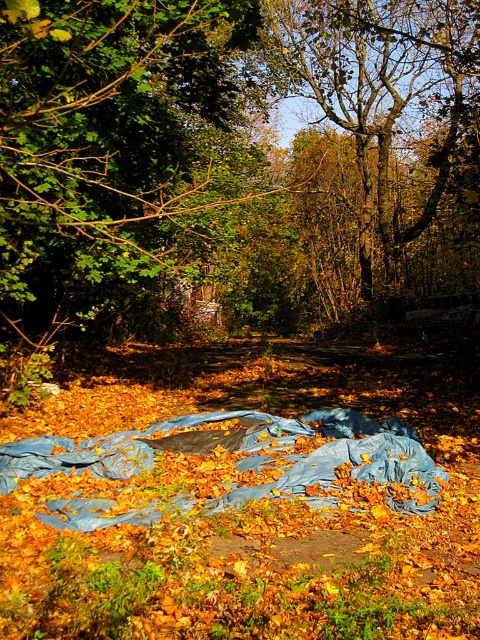
Between green leafy tree at upper left and brown textured tree at upper center, which one has more height?

Standing taller between the two is brown textured tree at upper center.

Looking at this image, which is below, green leafy tree at upper left or brown textured tree at upper center?

green leafy tree at upper left is lower down.

This screenshot has height=640, width=480. I want to click on green leafy tree at upper left, so click(x=112, y=148).